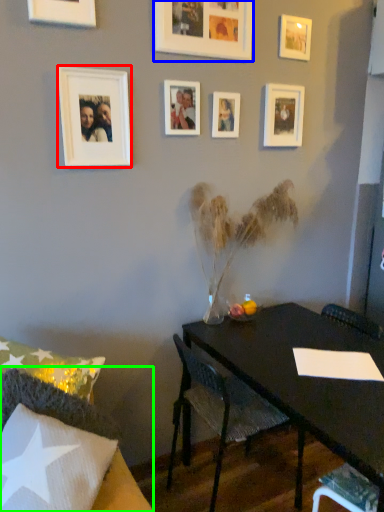
Question: Which object is positioned closest to picture frame (highlighted by a red box)? Select from picture frame (highlighted by a blue box) and chair (highlighted by a green box).

Choices:
 (A) picture frame
 (B) chair

Answer: (A)